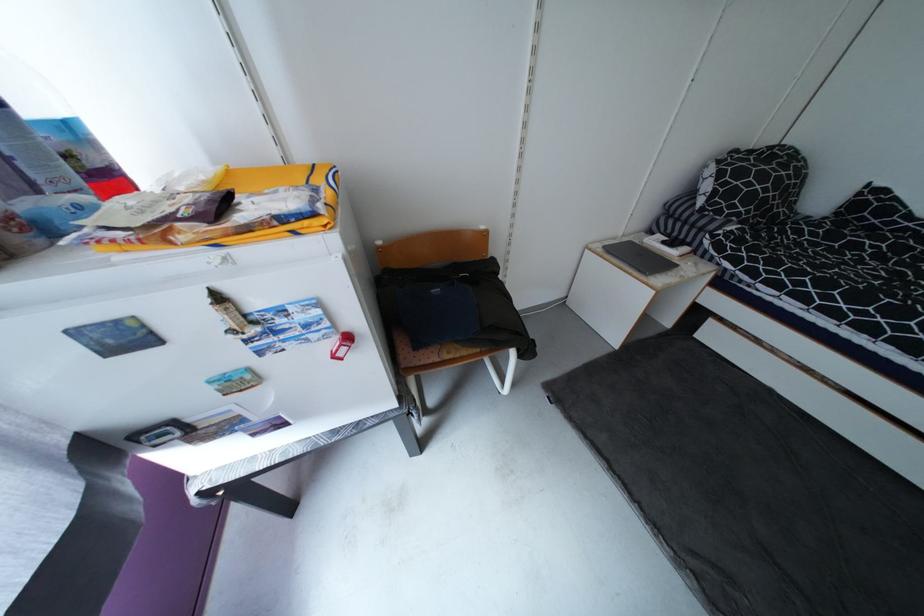
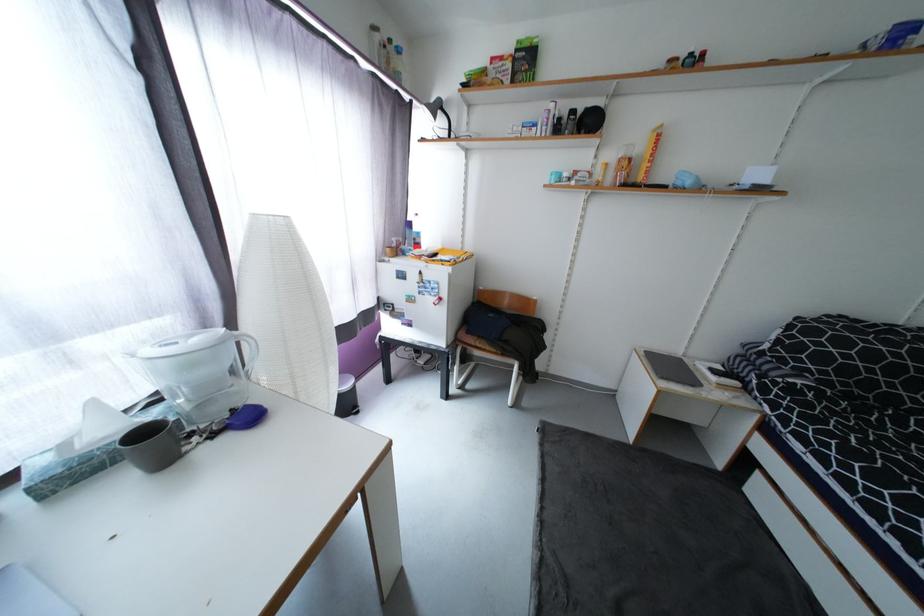
Where in the second image is the point corresponding to (x=661, y=527) from the first image?

(548, 524)